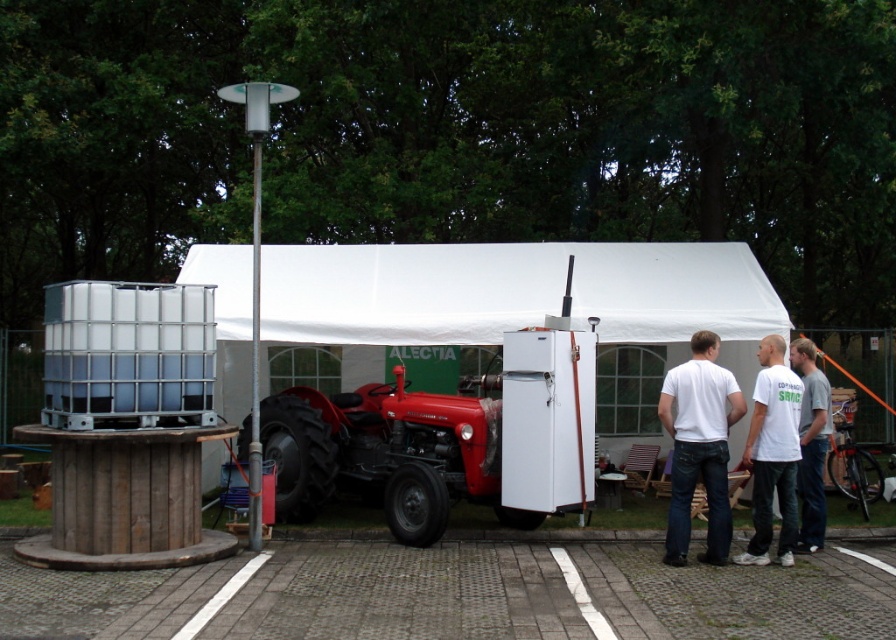
Can you confirm if white fabric tent at center is positioned below red metal tractor at center?

Actually, white fabric tent at center is above red metal tractor at center.

The image size is (896, 640). Identify the location of white fabric tent at center. (513, 310).

Image resolution: width=896 pixels, height=640 pixels. What do you see at coordinates (513, 310) in the screenshot? I see `white fabric tent at center` at bounding box center [513, 310].

The height and width of the screenshot is (640, 896). I want to click on white fabric tent at center, so click(x=513, y=310).

Between point (425, 344) and point (784, 488), which one is positioned in front?

Positioned in front is point (784, 488).

Is point (714, 324) closer to camera compared to point (770, 440)?

No, it is not.

Is point (337, 312) positioned before point (774, 355)?

No, it is behind (774, 355).

The height and width of the screenshot is (640, 896). In order to click on white fabric tent at center in this screenshot , I will do `click(513, 310)`.

Describe the element at coordinates (513, 310) in the screenshot. I see `white fabric tent at center` at that location.

Is white fabric tent at center smaller than white matte t-shirt at center?

Correct, white fabric tent at center occupies less space than white matte t-shirt at center.

This screenshot has width=896, height=640. What do you see at coordinates (513, 310) in the screenshot? I see `white fabric tent at center` at bounding box center [513, 310].

Locate an element on the screen. white fabric tent at center is located at coordinates (513, 310).